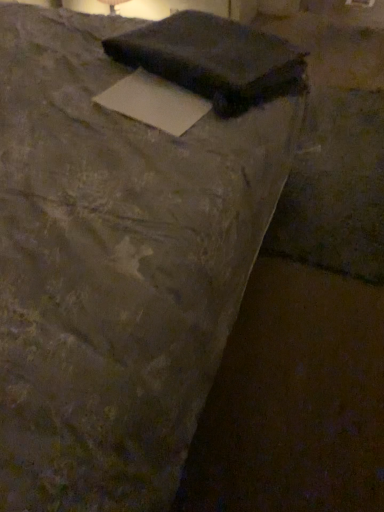
Image resolution: width=384 pixels, height=512 pixels. Identify the location of vacant region above white paper at center, the second writing from the top (from a real-world perspective). (155, 96).